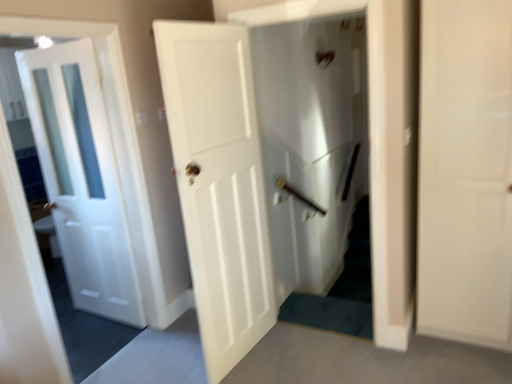
Describe the element at coordinates (219, 184) in the screenshot. I see `white matte door at center, which is the first door from right to left` at that location.

Describe the element at coordinates (82, 178) in the screenshot. I see `white glossy door at left, marked as the 1th door in a left-to-right arrangement` at that location.

Looking at this image, in order to face white glossy door at center, should I rotate leftwards or rightwards?

To face it directly, rotate right by 6.728 degrees.

What do you see at coordinates (311, 143) in the screenshot?
I see `white glossy door at center` at bounding box center [311, 143].

The width and height of the screenshot is (512, 384). In order to click on white matte door at center, which is the second door in left-to-right order in this screenshot , I will do coord(219,184).

Looking at their sizes, would you say white glossy door at left, the second door from the right, is wider or thinner than white matte door at center, which is the second door in left-to-right order?

white glossy door at left, the second door from the right, is wider than white matte door at center, which is the second door in left-to-right order.

Which is more to the right, white glossy door at left, the second door from the right, or white matte door at center, which is the second door in left-to-right order?

white matte door at center, which is the second door in left-to-right order.

Does white glossy door at left, marked as the 1th door in a left-to-right arrangement, have a lesser height compared to white matte door at center, which is the second door in left-to-right order?

Yes, white glossy door at left, marked as the 1th door in a left-to-right arrangement, is shorter than white matte door at center, which is the second door in left-to-right order.

From a real-world perspective, is white glossy door at left, marked as the 1th door in a left-to-right arrangement, positioned under white matte door at center, which is the first door from right to left, based on gravity?

No, from a real-world perspective, white glossy door at left, marked as the 1th door in a left-to-right arrangement, is not beneath white matte door at center, which is the first door from right to left.

Where is `door below the white glossy door at left, the second door from the right (from a real-world perspective)`? The width and height of the screenshot is (512, 384). door below the white glossy door at left, the second door from the right (from a real-world perspective) is located at coordinates [219, 184].

Is white matte door at center, which is the first door from right to left, not inside white glossy door at left, the second door from the right?

white matte door at center, which is the first door from right to left, is positioned outside white glossy door at left, the second door from the right.

Could you tell me if white matte door at center, which is the second door in left-to-right order, is facing white glossy door at left, marked as the 1th door in a left-to-right arrangement?

No.

Does white matte door at center, which is the second door in left-to-right order, appear on the right side of white glossy door at left, the second door from the right?

Correct, you'll find white matte door at center, which is the second door in left-to-right order, to the right of white glossy door at left, the second door from the right.

Looking at this image, from a real-world perspective, does white matte door at center, which is the second door in left-to-right order, sit lower than white glossy door at center?

Yes.

Between white matte door at center, which is the first door from right to left, and white glossy door at center, which one appears on the left side from the viewer's perspective?

white matte door at center, which is the first door from right to left.

Can you tell me how much white matte door at center, which is the first door from right to left, and white glossy door at center differ in facing direction?

white matte door at center, which is the first door from right to left, and white glossy door at center are facing 82.4 degrees away from each other.

Considering the points (258, 96) and (226, 328), which point is behind, point (258, 96) or point (226, 328)?

The point (258, 96) is behind.

Considering the positions of objects white glossy door at center and white matte door at center, which is the second door in left-to-right order, in the image provided, who is more to the left, white glossy door at center or white matte door at center, which is the second door in left-to-right order,?

white matte door at center, which is the second door in left-to-right order.

Is white glossy door at center wider than white matte door at center, which is the first door from right to left?

In fact, white glossy door at center might be narrower than white matte door at center, which is the first door from right to left.

Which of these two, white glossy door at center or white matte door at center, which is the first door from right to left, stands taller?

Standing taller between the two is white glossy door at center.

Does white glossy door at center have a larger size compared to white glossy door at left, marked as the 1th door in a left-to-right arrangement?

Incorrect, white glossy door at center is not larger than white glossy door at left, marked as the 1th door in a left-to-right arrangement.

How different are the orientations of white glossy door at center and white glossy door at left, the second door from the right, in degrees?

The angular difference between white glossy door at center and white glossy door at left, the second door from the right, is 2.32 degrees.

Is white glossy door at center completely or partially outside of white glossy door at left, the second door from the right?

Yes, white glossy door at center is not within white glossy door at left, the second door from the right.

Identify the location of elevator behind the white glossy door at left, marked as the 1th door in a left-to-right arrangement. (311, 143).

Does white glossy door at left, marked as the 1th door in a left-to-right arrangement, appear on the left side of white glossy door at center?

Indeed, white glossy door at left, marked as the 1th door in a left-to-right arrangement, is positioned on the left side of white glossy door at center.

Considering the sizes of white glossy door at left, the second door from the right, and white glossy door at center in the image, is white glossy door at left, the second door from the right, wider or thinner than white glossy door at center?

Considering their sizes, white glossy door at left, the second door from the right, looks broader than white glossy door at center.

Who is shorter, white glossy door at left, the second door from the right, or white glossy door at center?

white glossy door at left, the second door from the right, is shorter.

From a real-world perspective, is white glossy door at left, marked as the 1th door in a left-to-right arrangement, beneath white glossy door at center?

Incorrect, from a real-world perspective, white glossy door at left, marked as the 1th door in a left-to-right arrangement, is higher than white glossy door at center.

Where is `door below the white glossy door at left, the second door from the right (from the image's perspective)`? The image size is (512, 384). door below the white glossy door at left, the second door from the right (from the image's perspective) is located at coordinates (219, 184).

The width and height of the screenshot is (512, 384). Identify the location of door in front of the white glossy door at left, marked as the 1th door in a left-to-right arrangement. (219, 184).

Based on their spatial positions, is white glossy door at left, the second door from the right, or white matte door at center, which is the second door in left-to-right order, closer to white glossy door at center?

Based on the image, white matte door at center, which is the second door in left-to-right order, appears to be nearer to white glossy door at center.

When comparing their distances from white glossy door at left, marked as the 1th door in a left-to-right arrangement, does white matte door at center, which is the second door in left-to-right order, or white glossy door at center seem further?

white glossy door at center is positioned further to the anchor white glossy door at left, marked as the 1th door in a left-to-right arrangement.

Which object lies further to the anchor point white matte door at center, which is the second door in left-to-right order, white glossy door at left, marked as the 1th door in a left-to-right arrangement, or white glossy door at center?

Among the two, white glossy door at center is located further to white matte door at center, which is the second door in left-to-right order.

Estimate the real-world distances between objects in this image. Which object is closer to white glossy door at left, the second door from the right, white glossy door at center or white matte door at center, which is the second door in left-to-right order?

white matte door at center, which is the second door in left-to-right order, lies closer to white glossy door at left, the second door from the right, than the other object.

Which object lies further to the anchor point white glossy door at center, white matte door at center, which is the second door in left-to-right order, or white glossy door at left, the second door from the right?

Based on the image, white glossy door at left, the second door from the right, appears to be further to white glossy door at center.

From the image, which object appears to be farther from white matte door at center, which is the second door in left-to-right order, white glossy door at center or white glossy door at left, marked as the 1th door in a left-to-right arrangement?

white glossy door at center is further to white matte door at center, which is the second door in left-to-right order.

Find the location of `door between white glossy door at left, the second door from the right, and white glossy door at center`. door between white glossy door at left, the second door from the right, and white glossy door at center is located at coordinates (x=219, y=184).